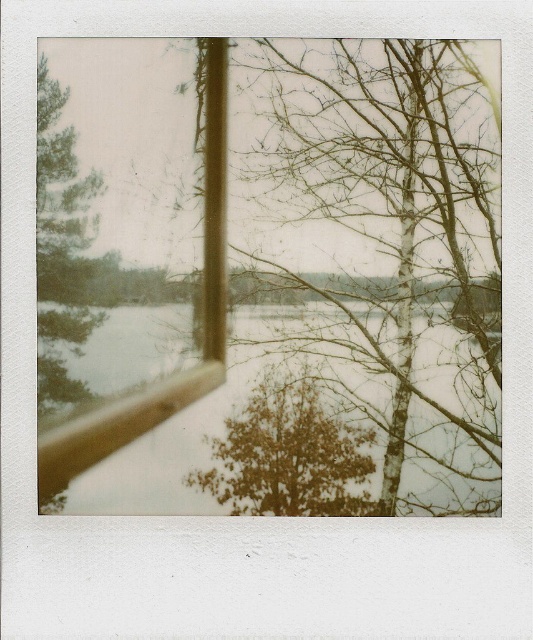
Which is behind, point (335, 513) or point (80, 180)?

Point (80, 180)

Between point (278, 496) and point (86, 243), which one is positioned behind?

Point (86, 243)

Locate an element on the screen. The width and height of the screenshot is (533, 640). brown textured tree at center is located at coordinates point(287,456).

Is snowy water at center positioned at the back of green matte tree at left?

Yes, snowy water at center is further from the viewer.

Which is behind, point (419, 429) or point (46, 280)?

Positioned behind is point (419, 429).

Between point (423, 472) and point (86, 396), which one is positioned behind?

Positioned behind is point (86, 396).

Find the location of a particular element. The image size is (533, 640). snowy water at center is located at coordinates (230, 413).

Who is lower down, bare wood tree at center or green matte tree at left?

Positioned lower is bare wood tree at center.

Does bare wood tree at center appear on the right side of green matte tree at left?

Correct, you'll find bare wood tree at center to the right of green matte tree at left.

Does point (390, 164) come closer to viewer compared to point (41, 353)?

That is False.

Identify the location of bare wood tree at center. Image resolution: width=533 pixels, height=640 pixels. pos(393,230).